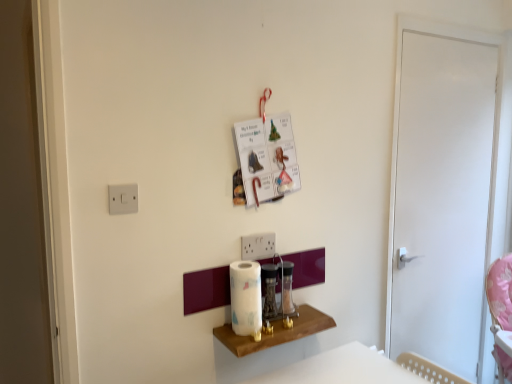
Question: Can you confirm if metallic silver blender at center, placed as the 2th appliance when sorted from right to left, is shorter than white glossy paper towel at center?

Choices:
 (A) no
 (B) yes

Answer: (B)

Question: Does metallic silver blender at center, placed as the 2th appliance when sorted from right to left, have a greater width compared to white glossy paper towel at center?

Choices:
 (A) yes
 (B) no

Answer: (B)

Question: From the image's perspective, is metallic silver blender at center, placed as the first appliance when sorted from left to right, located beneath white glossy paper towel at center?

Choices:
 (A) yes
 (B) no

Answer: (A)

Question: Does metallic silver blender at center, placed as the 2th appliance when sorted from right to left, have a lesser width compared to white glossy paper towel at center?

Choices:
 (A) no
 (B) yes

Answer: (B)

Question: From a real-world perspective, is metallic silver blender at center, placed as the first appliance when sorted from left to right, under white glossy paper towel at center?

Choices:
 (A) yes
 (B) no

Answer: (A)

Question: From the image's perspective, relative to wooden shelf at center, is white glossy door at right above or below?

Choices:
 (A) above
 (B) below

Answer: (A)

Question: Considering their positions, is white glossy door at right located in front of or behind wooden shelf at center?

Choices:
 (A) front
 (B) behind

Answer: (B)

Question: From a real-world perspective, is white glossy door at right above or below wooden shelf at center?

Choices:
 (A) above
 (B) below

Answer: (A)

Question: Looking at their shapes, would you say white glossy door at right is wider or thinner than wooden shelf at center?

Choices:
 (A) thin
 (B) wide

Answer: (A)

Question: From the image's perspective, is metallic silver blender at center, placed as the first appliance when sorted from left to right, above or below white glossy door at right?

Choices:
 (A) above
 (B) below

Answer: (B)

Question: Considering the positions of point (267, 276) and point (407, 294), is point (267, 276) closer or farther from the camera than point (407, 294)?

Choices:
 (A) closer
 (B) farther

Answer: (A)

Question: In the image, is metallic silver blender at center, placed as the 2th appliance when sorted from right to left, positioned in front of or behind white glossy door at right?

Choices:
 (A) front
 (B) behind

Answer: (A)

Question: From their relative heights in the image, would you say metallic silver blender at center, placed as the first appliance when sorted from left to right, is taller or shorter than white glossy door at right?

Choices:
 (A) tall
 (B) short

Answer: (B)

Question: Based on their sizes in the image, would you say white plastic light switch at upper left is bigger or smaller than clear glass jar at center, which is counted as the 1th appliance, starting from the right?

Choices:
 (A) big
 (B) small

Answer: (B)

Question: Would you say white plastic light switch at upper left is to the left or to the right of clear glass jar at center, which is counted as the 1th appliance, starting from the right, in the picture?

Choices:
 (A) right
 (B) left

Answer: (B)